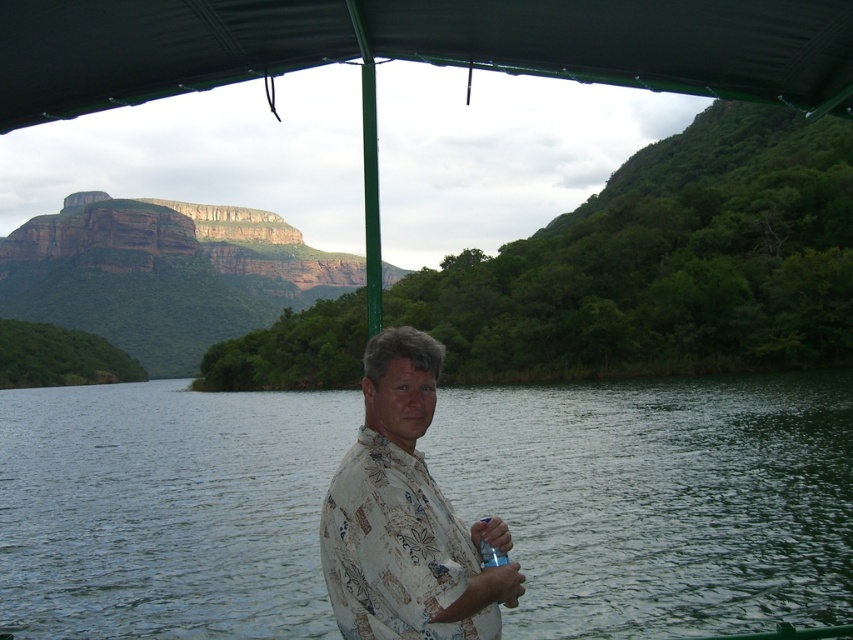
Does green liquid water at center come behind floral print shirt at center?

Yes, it is behind floral print shirt at center.

Between green liquid water at center and floral print shirt at center, which one appears on the right side from the viewer's perspective?

floral print shirt at center

Where is `green liquid water at center`? The width and height of the screenshot is (853, 640). green liquid water at center is located at coordinates (660, 499).

Does green liquid water at center appear over dark green fabric canopy at upper center?

Incorrect, green liquid water at center is not positioned above dark green fabric canopy at upper center.

Which is above, green liquid water at center or dark green fabric canopy at upper center?

Positioned higher is dark green fabric canopy at upper center.

Is point (3, 506) positioned after point (579, 56)?

Yes, point (3, 506) is behind point (579, 56).

I want to click on green liquid water at center, so click(x=660, y=499).

Between dark green fabric canopy at upper center and floral print shirt at center, which one has more height?

With more height is floral print shirt at center.

What do you see at coordinates (418, 45) in the screenshot? The width and height of the screenshot is (853, 640). I see `dark green fabric canopy at upper center` at bounding box center [418, 45].

Between point (241, 29) and point (474, 636), which one is positioned behind?

Positioned behind is point (241, 29).

Where is `dark green fabric canopy at upper center`? The image size is (853, 640). dark green fabric canopy at upper center is located at coordinates (418, 45).